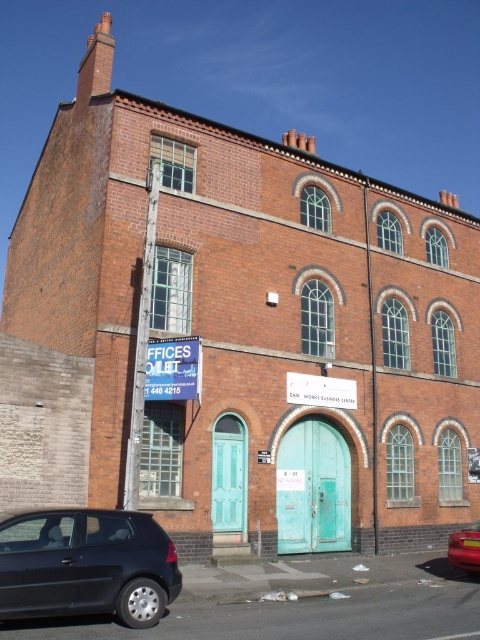
Question: Does matte black hatchback at lower left have a smaller size compared to metallic red car at lower right?

Choices:
 (A) yes
 (B) no

Answer: (A)

Question: Where is matte black hatchback at lower left located in relation to metallic red car at lower right in the image?

Choices:
 (A) below
 (B) above

Answer: (B)

Question: Is matte black hatchback at lower left bigger than metallic red car at lower right?

Choices:
 (A) no
 (B) yes

Answer: (A)

Question: Which point is farther from the camera taking this photo?

Choices:
 (A) (465, 552)
 (B) (31, 545)

Answer: (A)